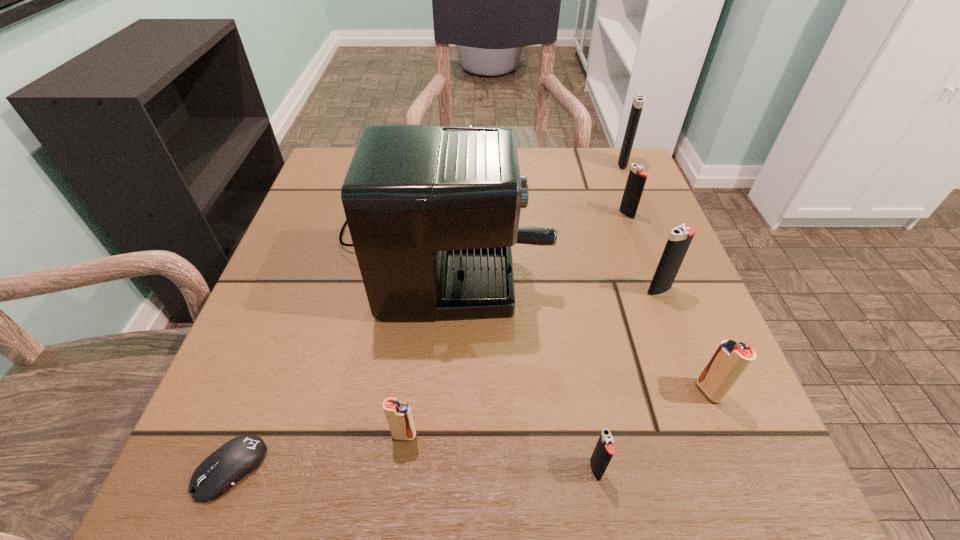
Find the location of `the sixth closest igniter relative to the computer equipment`. the sixth closest igniter relative to the computer equipment is located at coordinates (637, 105).

Where is `black igniter that is the second closest one to the leftmost black igniter`? The image size is (960, 540). black igniter that is the second closest one to the leftmost black igniter is located at coordinates (636, 180).

In order to click on black igniter that is the third closest one to the third tallest object in this screenshot , I will do `click(637, 105)`.

Where is `vacant area in the image that satisfies the following two spatial constraints: 1. on the front-facing side of the fifth farthest object; 2. on the left side of the coffee maker`? This screenshot has height=540, width=960. vacant area in the image that satisfies the following two spatial constraints: 1. on the front-facing side of the fifth farthest object; 2. on the left side of the coffee maker is located at coordinates (426, 392).

Where is `blank area in the image that satisfies the following two spatial constraints: 1. on the front-facing side of the black coffee maker; 2. on the left side of the fifth shortest igniter`? blank area in the image that satisfies the following two spatial constraints: 1. on the front-facing side of the black coffee maker; 2. on the left side of the fifth shortest igniter is located at coordinates (436, 290).

The height and width of the screenshot is (540, 960). Identify the location of vacant region that satisfies the following two spatial constraints: 1. on the front side of the farthest black igniter; 2. on the front-facing side of the tallest object. (651, 232).